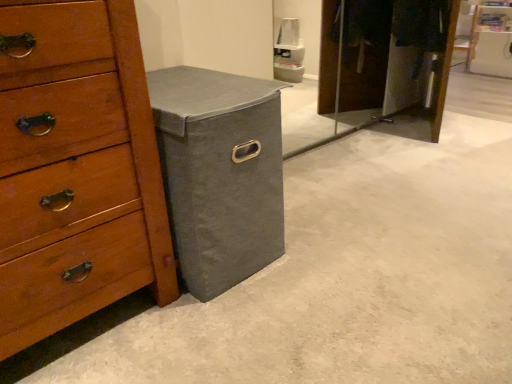
Where is `free space to the right of gray fabric storage bin at lower left`? free space to the right of gray fabric storage bin at lower left is located at coordinates (340, 257).